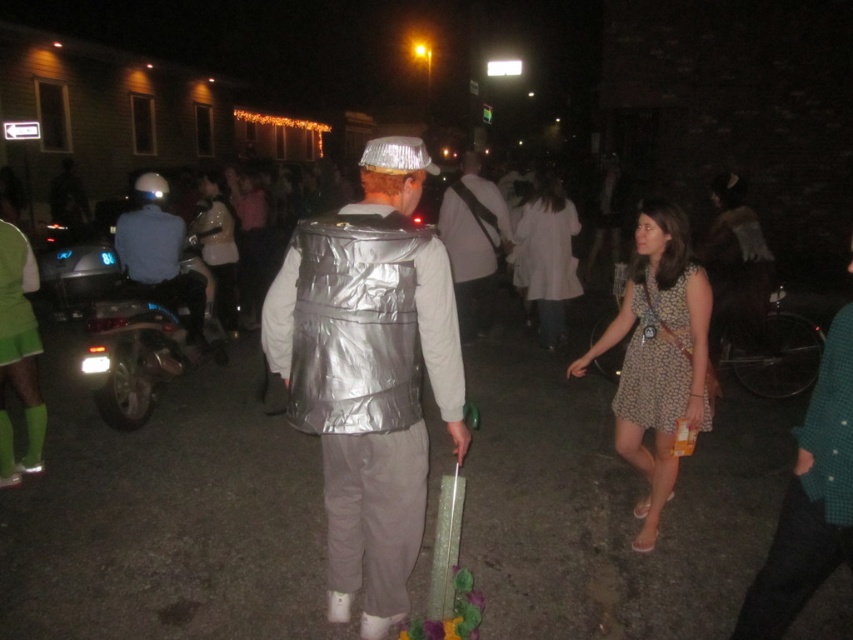
You are attending a costume party and see two dresses in the crowd. The dotted floral fabric dress at lower right and the matte white dress at center. Which dress is positioned lower in the image?

The dotted floral fabric dress at lower right is positioned lower in the image than the matte white dress at center.

You are a photographer at the event and want to capture both the dotted floral fabric dress at lower right and the matte white shirt at center in a single photo. Based on their positions, where should you position your camera to ensure both are visible?

Since the dotted floral fabric dress at lower right is located below the matte white shirt at center, you should position your camera at a lower angle to capture both the lower positioned dotted floral fabric dress at lower right and the higher positioned matte white shirt at center in the frame.